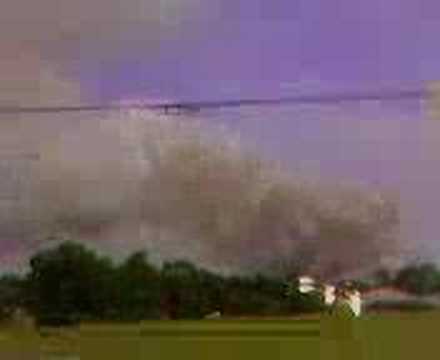
Locate an element on the screen. plant is located at coordinates (47, 290), (194, 290), (260, 295), (392, 340), (228, 352).